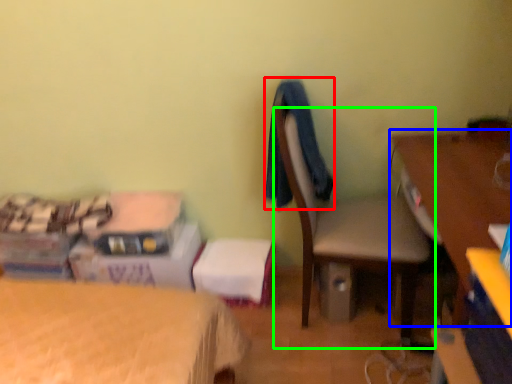
Question: Estimate the real-world distances between objects in this image. Which object is closer to clothing (highlighted by a red box), desk (highlighted by a blue box) or chair (highlighted by a green box)?

Choices:
 (A) desk
 (B) chair

Answer: (B)